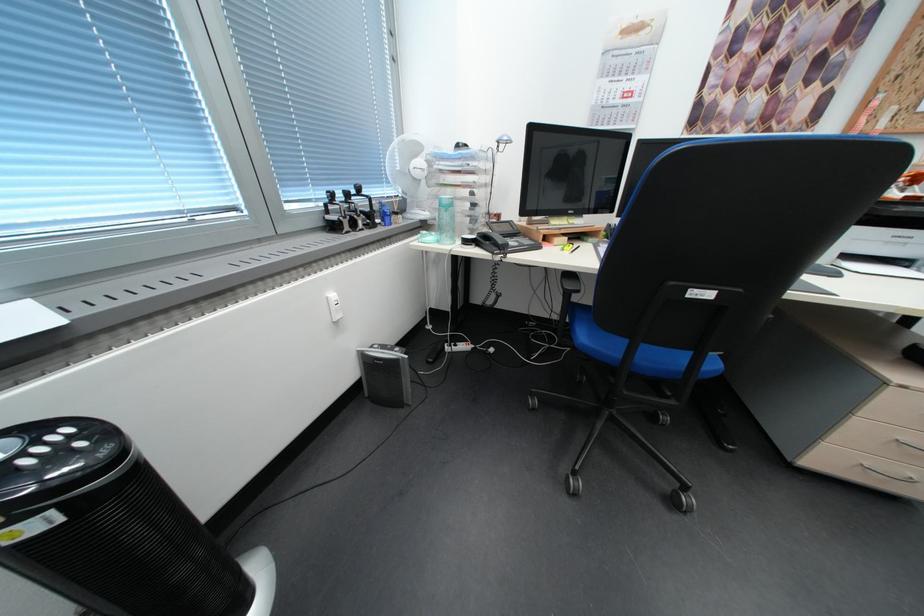
What do you see at coordinates (334, 209) in the screenshot? This screenshot has width=924, height=616. I see `the black stamp handle` at bounding box center [334, 209].